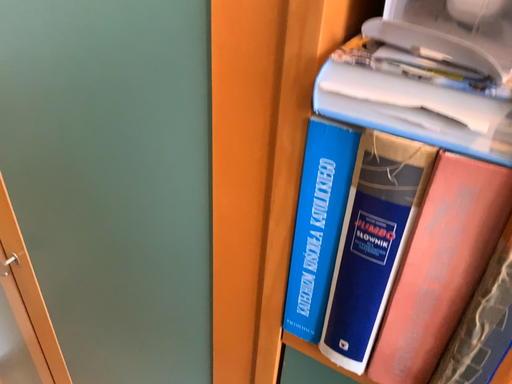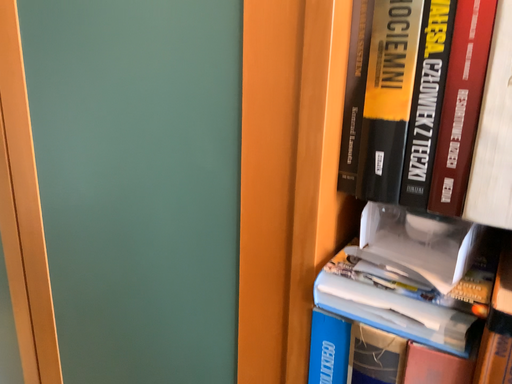
Question: How did the camera likely rotate when shooting the video?

Choices:
 (A) rotated upward
 (B) rotated downward

Answer: (A)